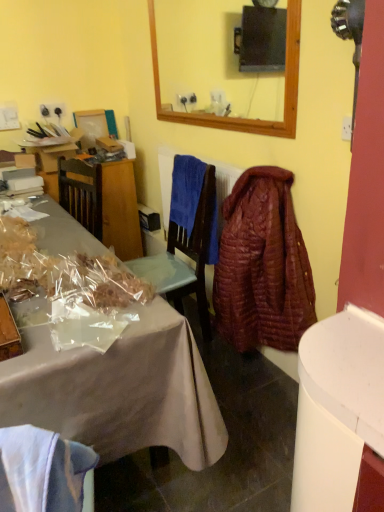
Question: Would you consider metallic cardboard box at lower left to be distant from quilted brown robe at center right?

Choices:
 (A) no
 (B) yes

Answer: (B)

Question: Is the surface of metallic cardboard box at lower left in direct contact with quilted brown robe at center right?

Choices:
 (A) no
 (B) yes

Answer: (A)

Question: From the image's perspective, is metallic cardboard box at lower left beneath quilted brown robe at center right?

Choices:
 (A) yes
 (B) no

Answer: (A)

Question: From the image's perspective, is metallic cardboard box at lower left on top of quilted brown robe at center right?

Choices:
 (A) yes
 (B) no

Answer: (B)

Question: Is metallic cardboard box at lower left outside quilted brown robe at center right?

Choices:
 (A) yes
 (B) no

Answer: (A)

Question: From their relative heights in the image, would you say metallic cardboard box at lower left is taller or shorter than quilted brown robe at center right?

Choices:
 (A) short
 (B) tall

Answer: (A)

Question: Considering their positions, is metallic cardboard box at lower left located in front of or behind quilted brown robe at center right?

Choices:
 (A) behind
 (B) front

Answer: (B)

Question: Considering the positions of metallic cardboard box at lower left and quilted brown robe at center right in the image, is metallic cardboard box at lower left wider or thinner than quilted brown robe at center right?

Choices:
 (A) thin
 (B) wide

Answer: (B)

Question: Is point (6, 354) positioned closer to the camera than point (213, 270)?

Choices:
 (A) farther
 (B) closer

Answer: (B)

Question: Considering the relative positions of quilted brown robe at center right and metallic cardboard box at lower left in the image provided, is quilted brown robe at center right to the left or to the right of metallic cardboard box at lower left?

Choices:
 (A) left
 (B) right

Answer: (B)

Question: From the image's perspective, is quilted brown robe at center right above or below metallic cardboard box at lower left?

Choices:
 (A) above
 (B) below

Answer: (A)

Question: From a real-world perspective, relative to metallic cardboard box at lower left, is quilted brown robe at center right vertically above or below?

Choices:
 (A) above
 (B) below

Answer: (A)

Question: In the image, is quilted brown robe at center right positioned in front of or behind metallic cardboard box at lower left?

Choices:
 (A) front
 (B) behind

Answer: (B)

Question: In the image, is blue soft towel at center on the left side or the right side of metallic cardboard box at lower left?

Choices:
 (A) left
 (B) right

Answer: (B)

Question: Is blue soft towel at center wider or thinner than metallic cardboard box at lower left?

Choices:
 (A) thin
 (B) wide

Answer: (A)